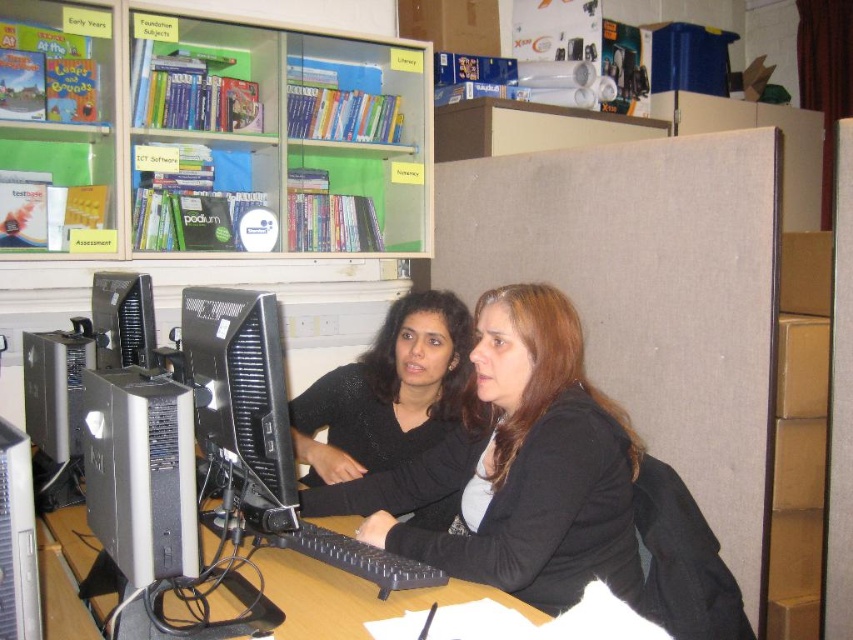
Question: Is clear plastic bookshelf at upper left to the right of matte black monitor at left from the viewer's perspective?

Choices:
 (A) yes
 (B) no

Answer: (A)

Question: From the image, what is the correct spatial relationship of clear plastic bookshelf at upper left in relation to black glossy monitor at center?

Choices:
 (A) left
 (B) right

Answer: (A)

Question: Does clear plastic bookshelf at upper left have a greater width compared to black matte sweater at center?

Choices:
 (A) yes
 (B) no

Answer: (A)

Question: Which point is closer to the camera?

Choices:
 (A) black matte sweater at center
 (B) wooden desk at center
 (C) matte black monitor at left
 (D) matte black sweater at center

Answer: (B)

Question: Which object is the closest to the clear plastic bookshelf at upper left?

Choices:
 (A) matte black sweater at center
 (B) black glossy monitor at center
 (C) black matte sweater at center
 (D) matte black monitor at left

Answer: (D)

Question: Which of the following is the closest to the observer?

Choices:
 (A) (198, 308)
 (B) (64, 525)

Answer: (A)